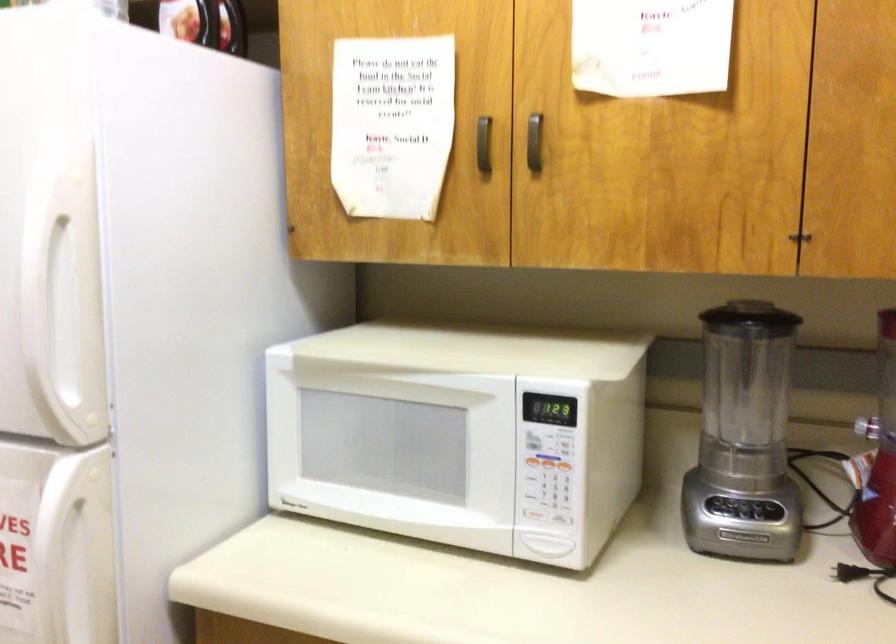
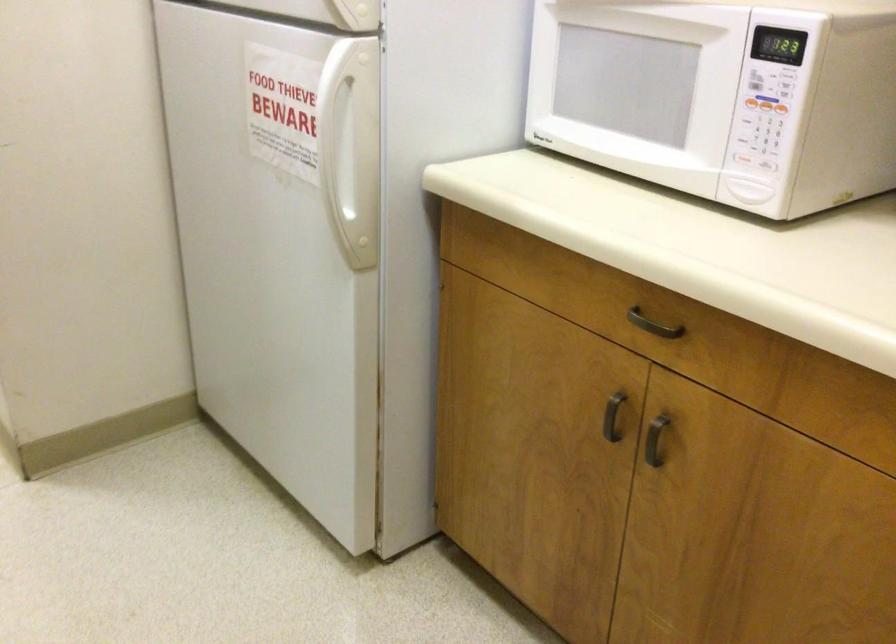
Find the pixel in the second image that matches (x=553, y=467) in the first image.

(765, 104)